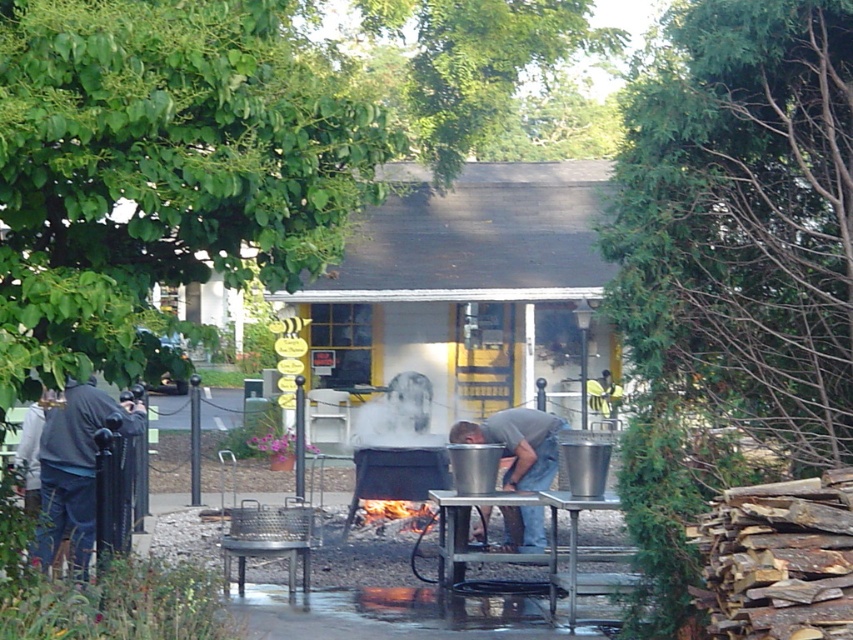
Is white foggy steam at center below charcoal gray wood at center?

No.

Measure the distance between point (397,387) and camera.

23.46 meters

Which is behind, point (381, 433) or point (398, 525)?

Positioned behind is point (381, 433).

Where is `white foggy steam at center`? This screenshot has width=853, height=640. white foggy steam at center is located at coordinates (396, 412).

Looking at this image, can you confirm if dark gray fabric at left is positioned below charcoal gray wood at center?

Actually, dark gray fabric at left is above charcoal gray wood at center.

Is point (105, 401) positioned after point (399, 513)?

No.

This screenshot has height=640, width=853. I want to click on dark gray fabric at left, so click(x=74, y=468).

Where is `dark gray fabric at left`? The width and height of the screenshot is (853, 640). dark gray fabric at left is located at coordinates [x=74, y=468].

Does gray matte shirt at center have a lesser height compared to white foggy steam at center?

No, gray matte shirt at center is not shorter than white foggy steam at center.

Who is more distant from viewer, (496, 426) or (416, 417)?

Positioned behind is point (416, 417).

Who is more forward, (535, 426) or (376, 435)?

Positioned in front is point (535, 426).

Where is `gray matte shirt at center`? The width and height of the screenshot is (853, 640). gray matte shirt at center is located at coordinates (518, 444).